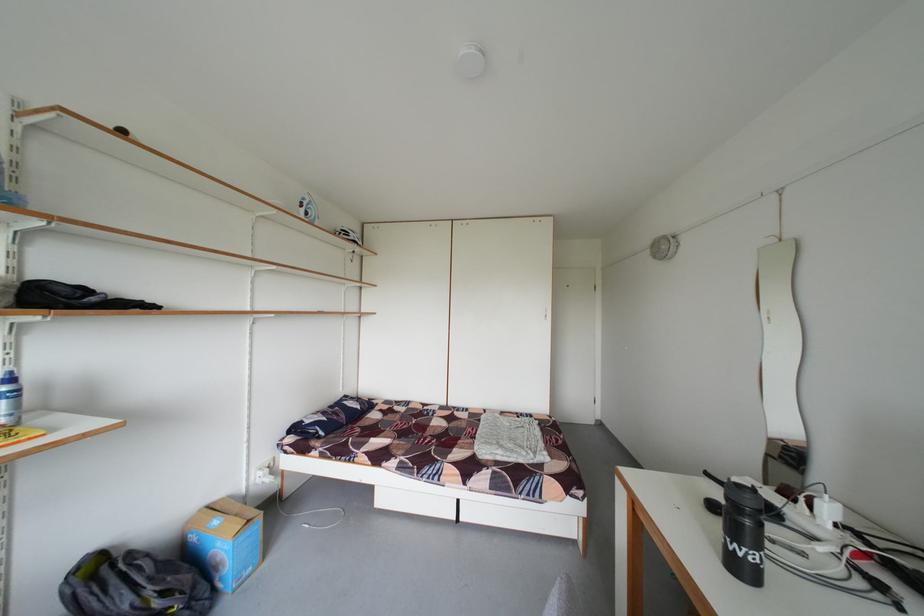
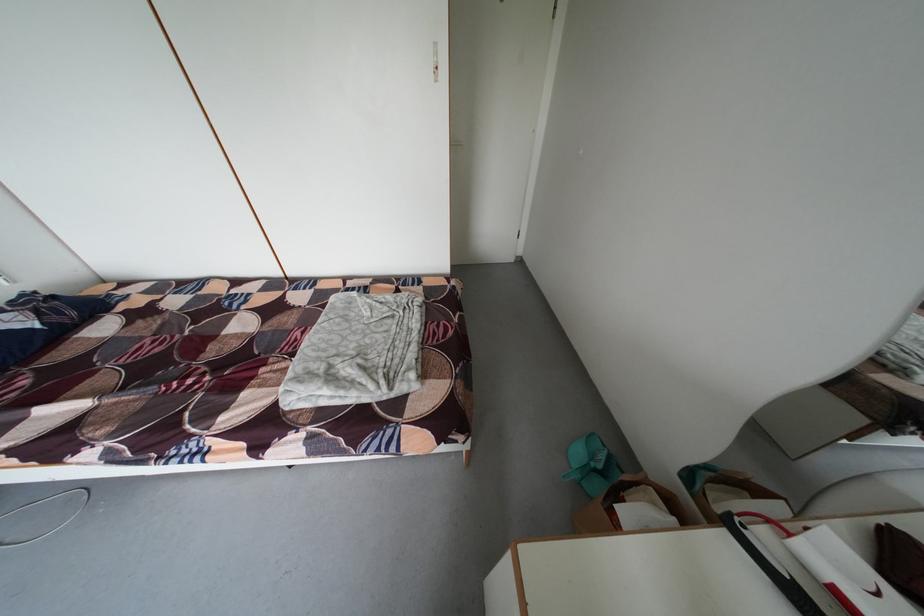
Locate, in the second image, the point that corresponds to (x=480, y=435) in the first image.

(309, 339)